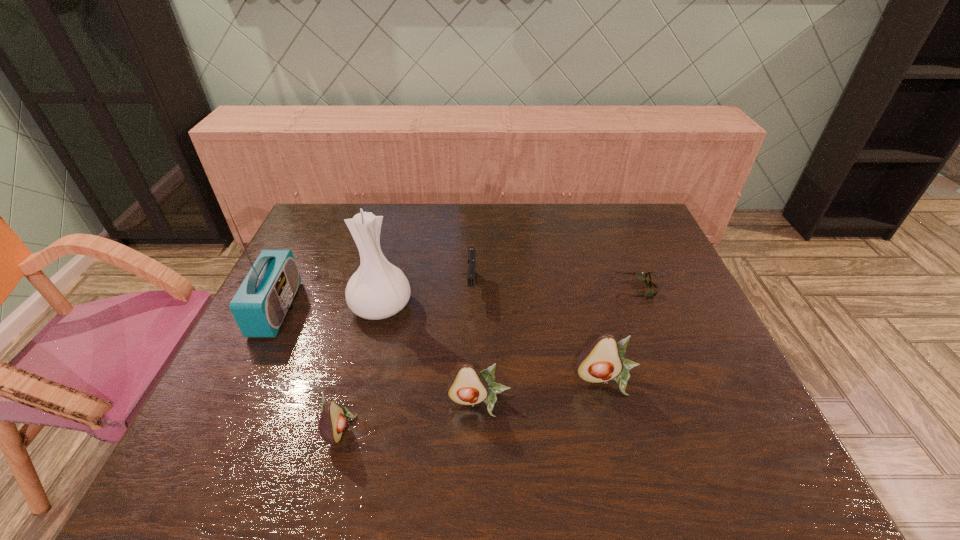
In order to click on blank space that satisfies the following two spatial constraints: 1. on the seed side of the second object from right to left; 2. on the seed side of the leftmost avocado in this screenshot , I will do `click(619, 427)`.